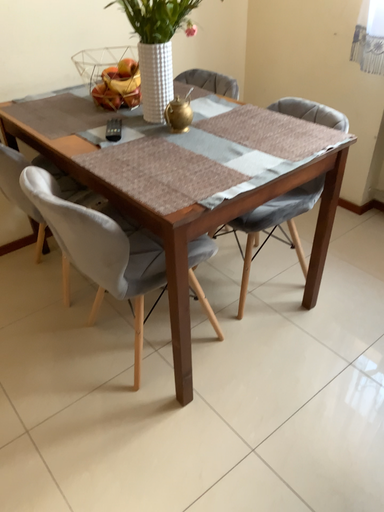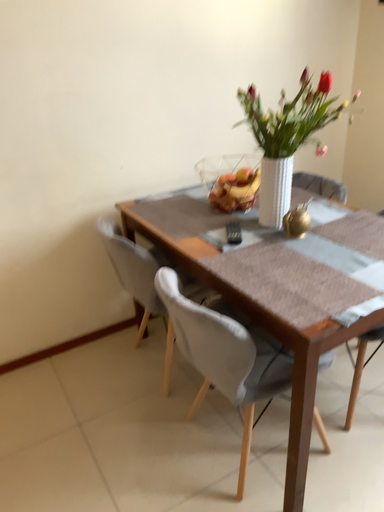
Question: Which way did the camera rotate in the video?

Choices:
 (A) rotated right
 (B) rotated left

Answer: (B)